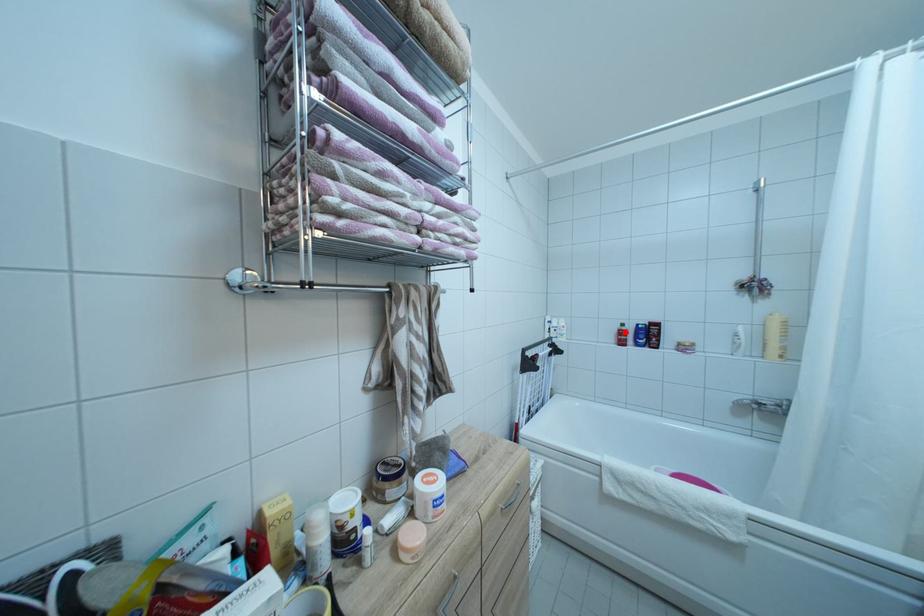
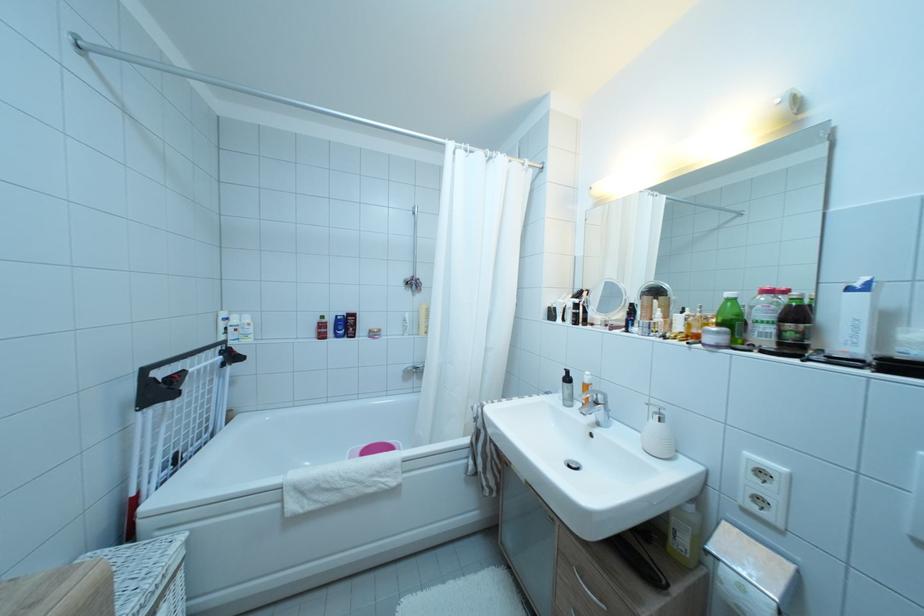
The point at the highlighted location is marked in the first image. Where is the corresponding point in the second image?

(324, 325)